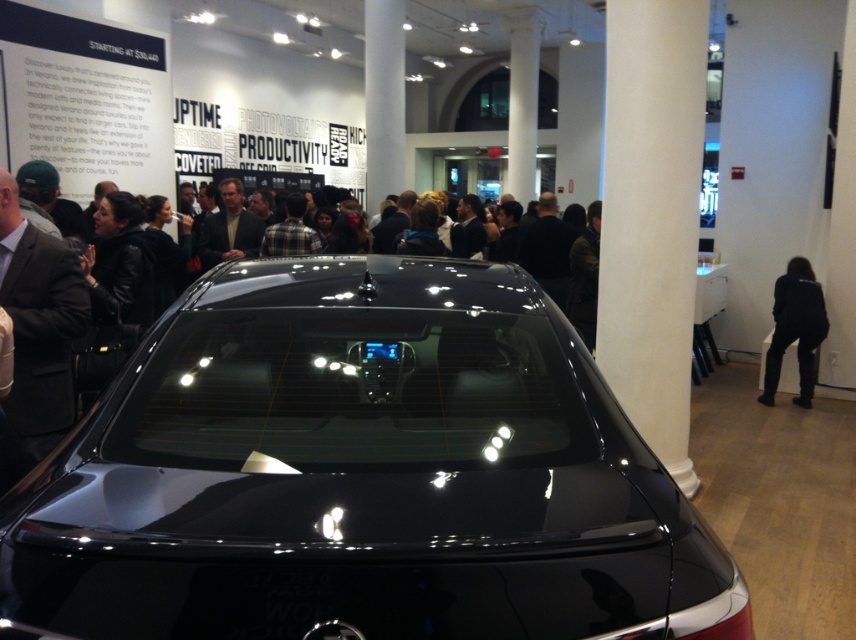
Question: Does glossy black car at center have a smaller size compared to black fabric jacket at lower right?

Choices:
 (A) yes
 (B) no

Answer: (B)

Question: Can you confirm if glossy black car at center is positioned to the right of black fabric jacket at lower right?

Choices:
 (A) no
 (B) yes

Answer: (A)

Question: Does glossy black car at center have a larger size compared to black fabric jacket at lower right?

Choices:
 (A) no
 (B) yes

Answer: (B)

Question: Which point is farther to the camera?

Choices:
 (A) (764, 364)
 (B) (455, 305)

Answer: (A)